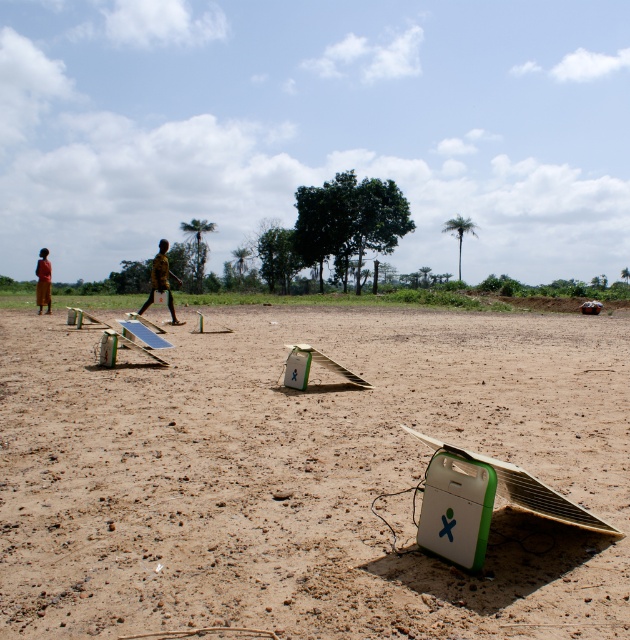
Is brown sandy dirt at center bigger than yellow matte shirt at center?

Yes.

Can you confirm if brown sandy dirt at center is taller than yellow matte shirt at center?

In fact, brown sandy dirt at center may be shorter than yellow matte shirt at center.

Is point (547, 317) closer to camera compared to point (166, 246)?

No, (547, 317) is further to viewer.

Locate an element on the screen. The width and height of the screenshot is (630, 640). brown sandy dirt at center is located at coordinates (306, 476).

Does yellow matte shirt at center lie behind red fabric person at left?

A: No, yellow matte shirt at center is in front of red fabric person at left.

Is yellow matte shirt at center taller than red fabric person at left?

No.

Between point (173, 320) and point (45, 292), which one is positioned in front?

Positioned in front is point (173, 320).

Locate an element on the screen. This screenshot has height=640, width=630. yellow matte shirt at center is located at coordinates (161, 280).

From the picture: Is brown sandy dirt at center thinner than red fabric person at left?

Yes, brown sandy dirt at center is thinner than red fabric person at left.

Is point (81, 451) positioned after point (35, 266)?

No, it is not.

Find the location of a particular element. Image resolution: width=630 pixels, height=640 pixels. brown sandy dirt at center is located at coordinates (306, 476).